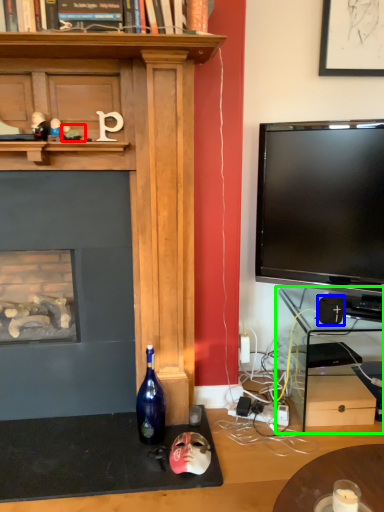
Question: Considering the real-world distances, which object is farthest from toy (highlighted by a red box)? speaker (highlighted by a blue box) or computer desk (highlighted by a green box)?

Choices:
 (A) speaker
 (B) computer desk

Answer: (B)